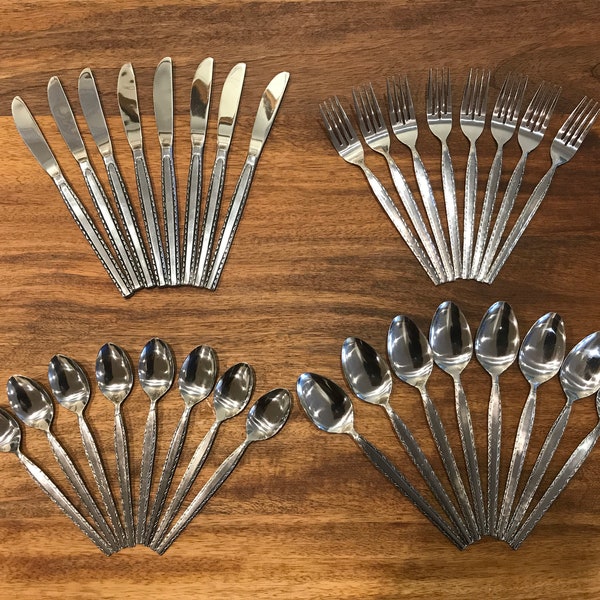
The width and height of the screenshot is (600, 600). I want to click on fork, so click(x=350, y=146), click(x=375, y=139), click(x=405, y=130), click(x=438, y=125), click(x=469, y=124), click(x=501, y=127), click(x=525, y=135), click(x=558, y=147).